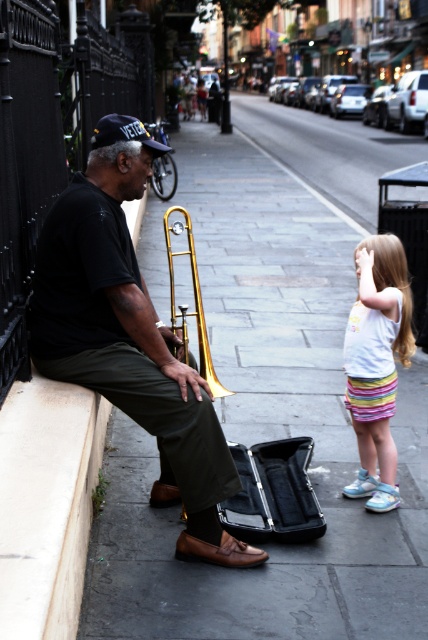
Question: Which point is farther to the camera?

Choices:
 (A) (309, 212)
 (B) (148, 141)

Answer: (A)

Question: Is gold brass trombone at center below blue denim baseball cap at left?

Choices:
 (A) yes
 (B) no

Answer: (A)

Question: Estimate the real-world distances between objects in this image. Which object is closer to the gold brass trombone at center?

Choices:
 (A) shiny gold trombone at left
 (B) dark gray stone pavement at lower left
 (C) pastel striped skirt at lower right

Answer: (A)

Question: Does shiny gold trombone at left come behind gold brass trombone at center?

Choices:
 (A) yes
 (B) no

Answer: (B)

Question: Can you confirm if shiny gold trombone at left is positioned to the right of gold brass trombone at center?

Choices:
 (A) no
 (B) yes

Answer: (A)

Question: Based on their relative distances, which object is farther from the gold brass trombone at center?

Choices:
 (A) pastel striped skirt at lower right
 (B) shiny gold trombone at left

Answer: (A)